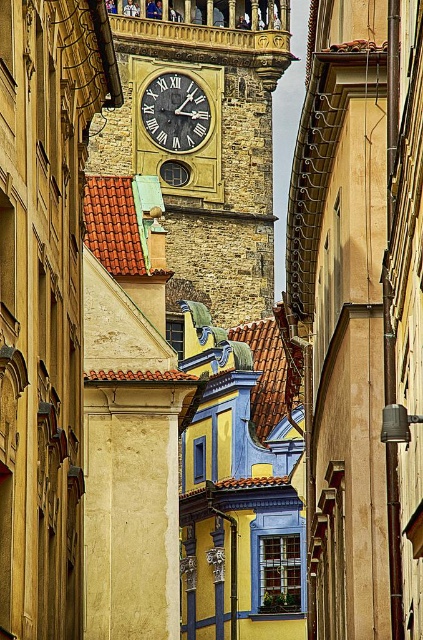
You are standing at the point with coordinates (202, 136) in the image. What object is located exactly at this point?

The stone clock tower at center is located exactly at point (202, 136).

You are standing on the street looking at the clock tower. There are two points marked on the image, one at coordinates point (x=220, y=212) and another at point (x=143, y=116). Which point is closer to you?

Point (x=143, y=116) is closer to you because it is less further to the camera than point (x=220, y=212).